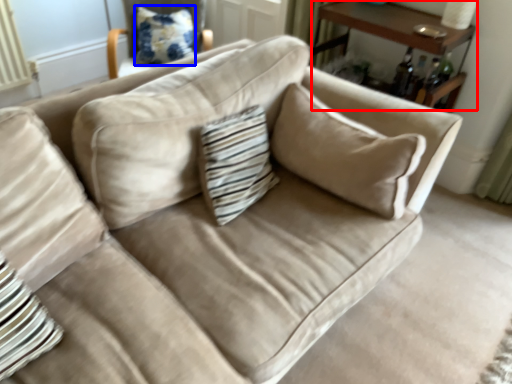
Question: Which object is closer to the camera taking this photo, table (highlighted by a red box) or pillow (highlighted by a blue box)?

Choices:
 (A) table
 (B) pillow

Answer: (A)